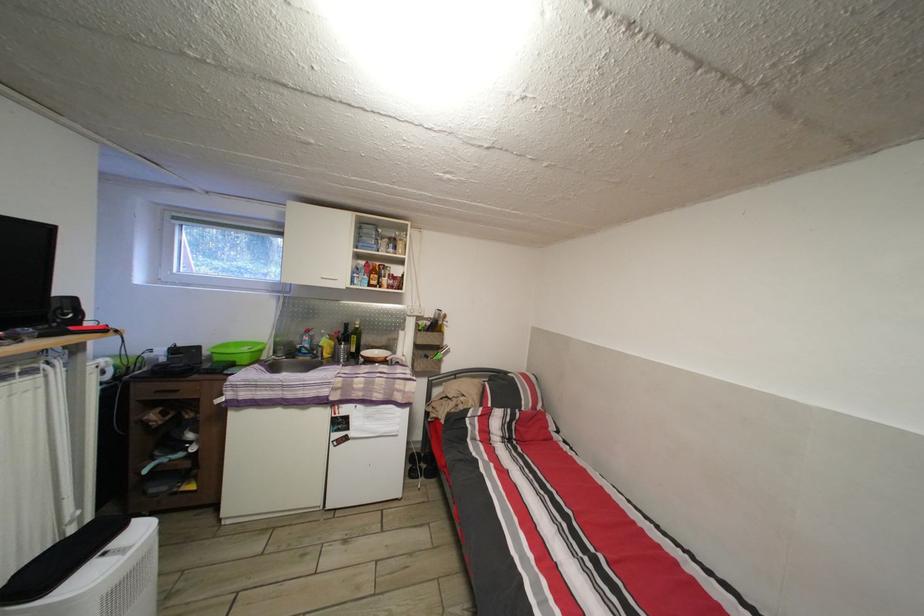
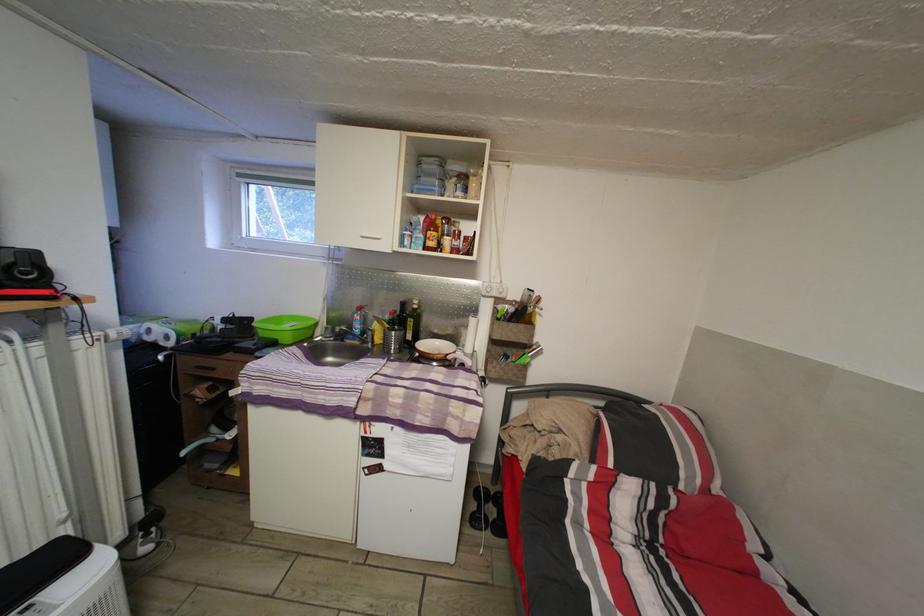
The point at (x=360, y=357) is marked in the first image. Where is the corresponding point in the second image?

(417, 344)